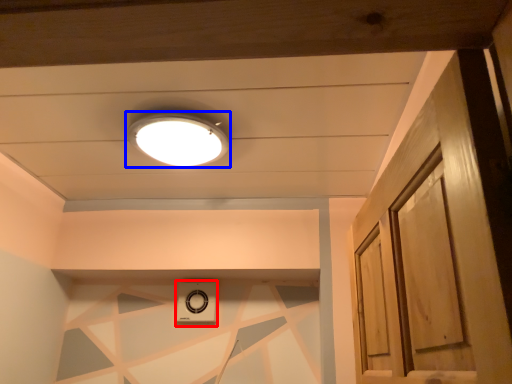
Question: Among these objects, which one is nearest to the camera, appliance (highlighted by a red box) or lamp (highlighted by a blue box)?

Choices:
 (A) appliance
 (B) lamp

Answer: (B)